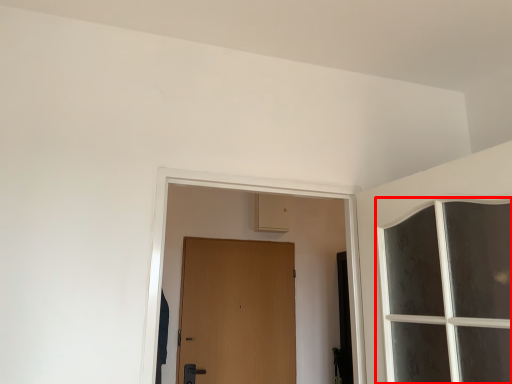
Question: In this image, where is window (annotated by the red box) located relative to door?

Choices:
 (A) right
 (B) left

Answer: (A)